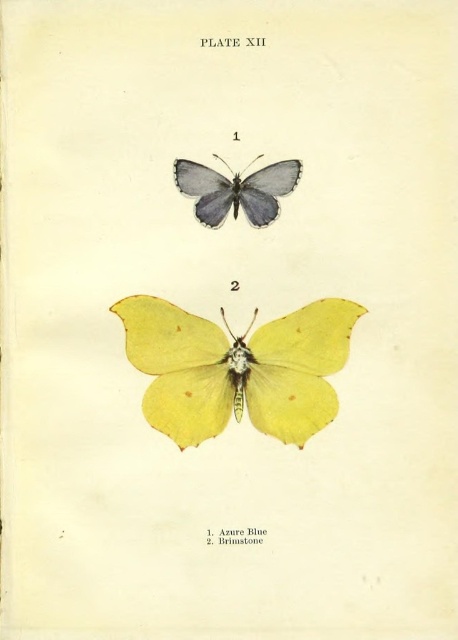
Question: Can you confirm if matte yellow butterfly at lower center is positioned above matte azure blue butterfly at upper center?

Choices:
 (A) yes
 (B) no

Answer: (B)

Question: Among these objects, which one is nearest to the camera?

Choices:
 (A) matte yellow butterfly at lower center
 (B) matte azure blue butterfly at upper center

Answer: (B)

Question: Does matte yellow butterfly at lower center appear on the right side of matte azure blue butterfly at upper center?

Choices:
 (A) yes
 (B) no

Answer: (A)

Question: Is matte yellow butterfly at lower center behind matte azure blue butterfly at upper center?

Choices:
 (A) yes
 (B) no

Answer: (A)

Question: Which object appears farthest from the camera in this image?

Choices:
 (A) matte yellow butterfly at lower center
 (B) matte azure blue butterfly at upper center

Answer: (A)